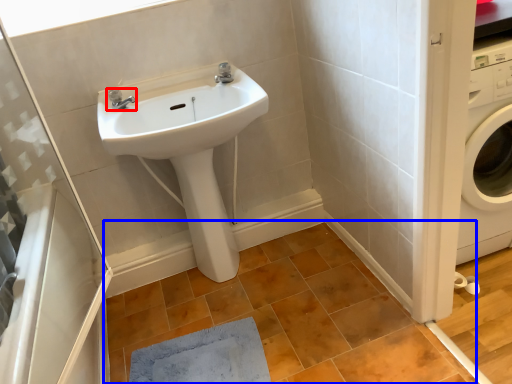
Question: Which of the following is the closest to the observer, tap (highlighted by a red box) or tile (highlighted by a blue box)?

Choices:
 (A) tap
 (B) tile

Answer: (B)